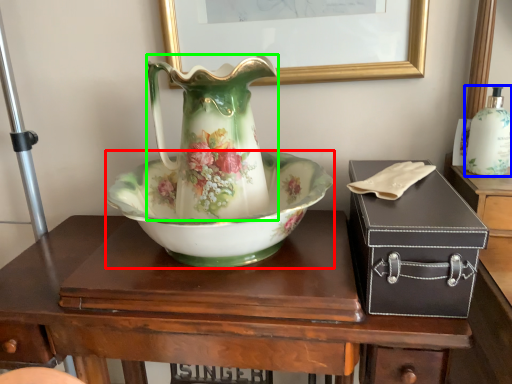
Question: Considering the real-world distances, which object is closest to bowl (highlighted by a red box)? bottle (highlighted by a blue box) or vase (highlighted by a green box).

Choices:
 (A) bottle
 (B) vase

Answer: (B)